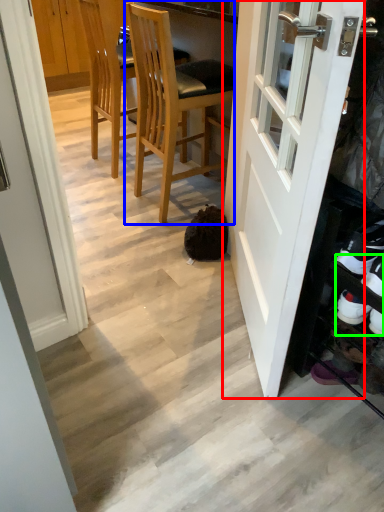
Question: Based on their relative distances, which object is farther from door (highlighted by a red box)? Choose from chair (highlighted by a blue box) and shoe (highlighted by a green box).

Choices:
 (A) chair
 (B) shoe

Answer: (A)